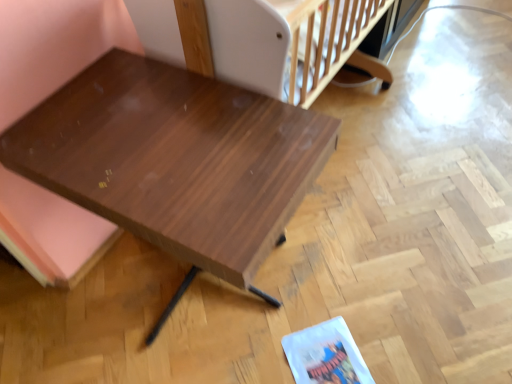
Question: From the image's perspective, would you say white plastic infant bed at upper center is positioned over shiny brown wood table at center?

Choices:
 (A) yes
 (B) no

Answer: (A)

Question: Is white plastic infant bed at upper center shorter than shiny brown wood table at center?

Choices:
 (A) yes
 (B) no

Answer: (A)

Question: Does white plastic infant bed at upper center have a lesser width compared to shiny brown wood table at center?

Choices:
 (A) no
 (B) yes

Answer: (B)

Question: From the image's perspective, is white plastic infant bed at upper center located beneath shiny brown wood table at center?

Choices:
 (A) yes
 (B) no

Answer: (B)

Question: Would you say shiny brown wood table at center is part of white plastic infant bed at upper center's contents?

Choices:
 (A) yes
 (B) no

Answer: (B)

Question: Is white plastic infant bed at upper center smaller than shiny brown wood table at center?

Choices:
 (A) no
 (B) yes

Answer: (B)

Question: Is shiny brown wood table at center facing towards white plastic infant bed at upper center?

Choices:
 (A) no
 (B) yes

Answer: (A)

Question: Would you say shiny brown wood table at center contains white plastic infant bed at upper center?

Choices:
 (A) yes
 (B) no

Answer: (B)

Question: From the image's perspective, is shiny brown wood table at center below white plastic infant bed at upper center?

Choices:
 (A) no
 (B) yes

Answer: (B)

Question: Does shiny brown wood table at center lie in front of white plastic infant bed at upper center?

Choices:
 (A) yes
 (B) no

Answer: (A)

Question: Is shiny brown wood table at center to the left of white plastic infant bed at upper center from the viewer's perspective?

Choices:
 (A) yes
 (B) no

Answer: (A)

Question: Is shiny brown wood table at center far from white plastic infant bed at upper center?

Choices:
 (A) no
 (B) yes

Answer: (A)

Question: Would you say shiny brown wood table at center is to the left or to the right of white plastic infant bed at upper center in the picture?

Choices:
 (A) right
 (B) left

Answer: (B)